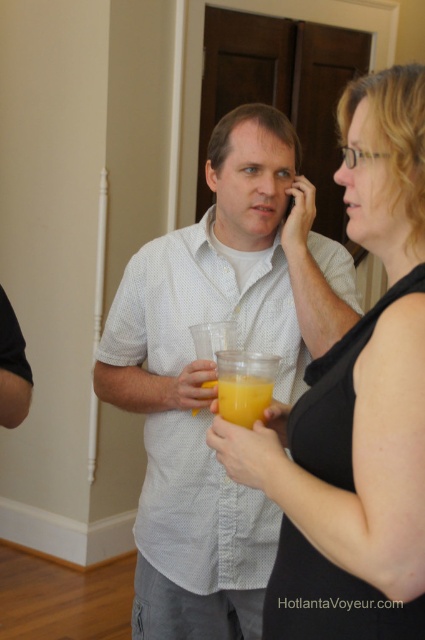
Is black matte tank top at center below translucent plastic cup at center?

No, black matte tank top at center is not below translucent plastic cup at center.

The width and height of the screenshot is (425, 640). Find the location of `black matte tank top at center`. black matte tank top at center is located at coordinates (356, 406).

Can you confirm if white dotted shirt at center is taller than translucent plastic cup at center?

Correct, white dotted shirt at center is much taller as translucent plastic cup at center.

Does point (297, 308) lie behind point (257, 385)?

Yes, it is.

What do you see at coordinates (215, 372) in the screenshot? This screenshot has height=640, width=425. I see `white dotted shirt at center` at bounding box center [215, 372].

The height and width of the screenshot is (640, 425). What are the coordinates of `white dotted shirt at center` in the screenshot? It's located at (215, 372).

Is point (158, 252) positioned in front of point (388, 364)?

No, it is behind (388, 364).

Is point (164, 308) farther from camera compared to point (271, 632)?

That is True.

At what (x,y) coordinates should I click in order to perform the action: click on white dotted shirt at center. Please return your answer as a coordinate pair (x, y). This screenshot has height=640, width=425. Looking at the image, I should click on [215, 372].